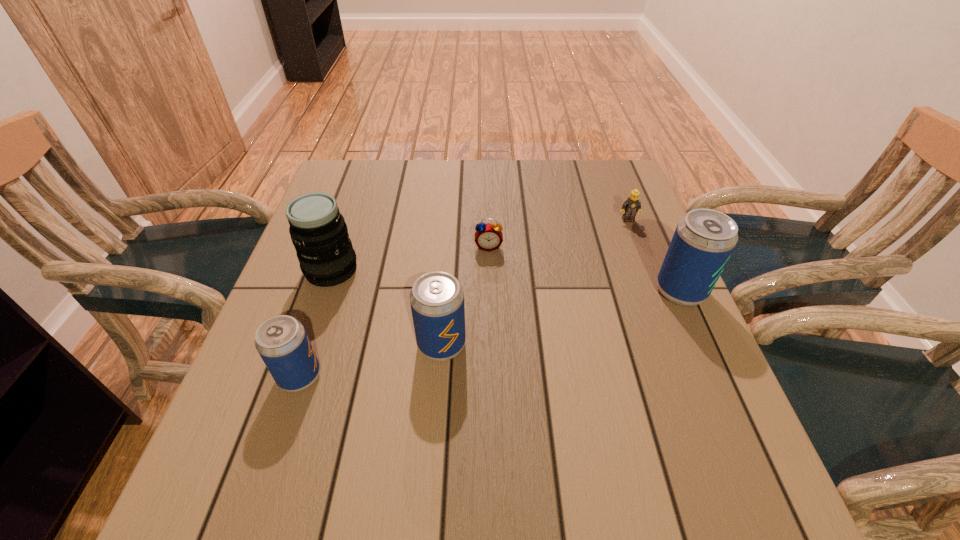
Identify the location of the shortest beer can. (282, 342).

You are a GUI agent. You are given a task and a screenshot of the screen. Output one action in this format:
    pyautogui.click(x=<x>, y=<y>)
    Task: Click on the leftmost beer can
    This screenshot has height=540, width=960.
    Given the screenshot: What is the action you would take?
    pyautogui.click(x=282, y=342)

Locate an element on the screen. This screenshot has height=540, width=960. the second beer can from left to right is located at coordinates (437, 298).

You are a GUI agent. You are given a task and a screenshot of the screen. Output one action in this format:
    pyautogui.click(x=<x>, y=<y>)
    Task: Click on the second shortest beer can
    This screenshot has width=960, height=540.
    Given the screenshot: What is the action you would take?
    tap(437, 298)

The height and width of the screenshot is (540, 960). I want to click on the farthest beer can, so click(704, 239).

Identify the location of Lego. The width and height of the screenshot is (960, 540). (632, 205).

The width and height of the screenshot is (960, 540). Identify the location of alarm clock. (488, 237).

The image size is (960, 540). What are the coordinates of `the third object from right to left` in the screenshot? It's located at [488, 237].

Image resolution: width=960 pixels, height=540 pixels. Identify the location of telephoto lens. (319, 233).

This screenshot has width=960, height=540. I want to click on vacant space situated 0.350m on the back of the leftmost beer can, so click(345, 242).